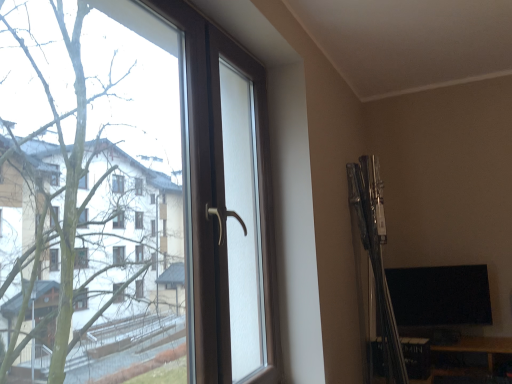
Question: Is brown plastic window at left wider or thinner than black glossy monitor at lower right?

Choices:
 (A) thin
 (B) wide

Answer: (B)

Question: Looking at the image, does brown plastic window at left seem bigger or smaller compared to black glossy monitor at lower right?

Choices:
 (A) small
 (B) big

Answer: (B)

Question: From a real-world perspective, relative to black glossy monitor at lower right, is brown plastic window at left vertically above or below?

Choices:
 (A) below
 (B) above

Answer: (B)

Question: From a real-world perspective, is black glossy monitor at lower right above or below brown plastic window at left?

Choices:
 (A) below
 (B) above

Answer: (A)

Question: Is black glossy monitor at lower right bigger or smaller than brown plastic window at left?

Choices:
 (A) small
 (B) big

Answer: (A)

Question: Considering the positions of black glossy monitor at lower right and brown plastic window at left in the image, is black glossy monitor at lower right taller or shorter than brown plastic window at left?

Choices:
 (A) tall
 (B) short

Answer: (B)

Question: Do you think black glossy monitor at lower right is within brown plastic window at left, or outside of it?

Choices:
 (A) inside
 (B) outside

Answer: (B)